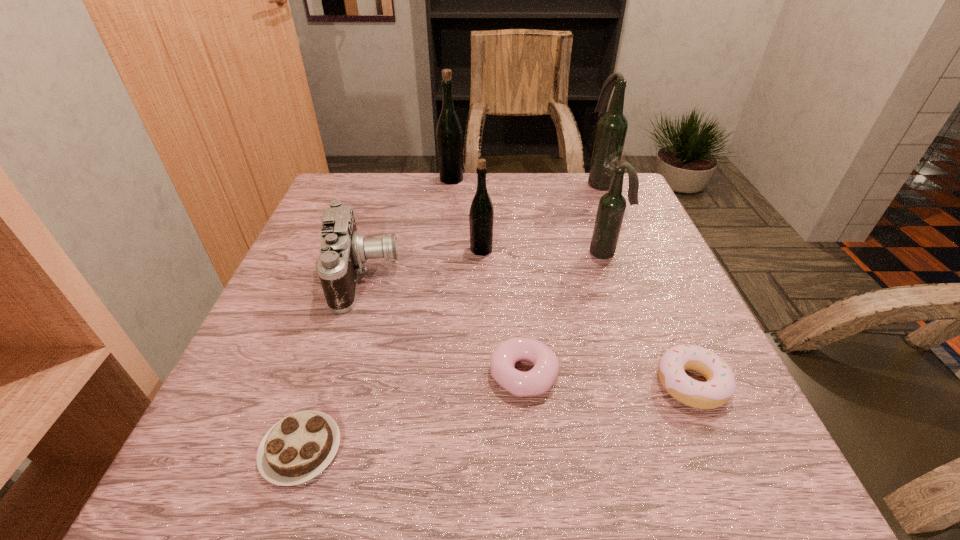
Image resolution: width=960 pixels, height=540 pixels. Find the location of `free space located 0.220m on the front of the leftmost beer bottle`. free space located 0.220m on the front of the leftmost beer bottle is located at coordinates (446, 231).

The height and width of the screenshot is (540, 960). I want to click on free space located 0.220m on the front of the farther dark beer bottle, so click(x=623, y=238).

The height and width of the screenshot is (540, 960). What are the coordinates of `free space located 0.150m on the left of the right green beer bottle` in the screenshot? It's located at (405, 250).

Locate an element on the screen. This screenshot has height=540, width=960. free location located 0.170m on the back of the nearer dark beer bottle is located at coordinates (590, 206).

You are a GUI agent. You are given a task and a screenshot of the screen. Output one action in this format:
    pyautogui.click(x=<x>, y=<y>)
    Task: Click on the vacant space located at the lens of the fifth tallest object
    The width and height of the screenshot is (960, 540).
    Given the screenshot: What is the action you would take?
    pyautogui.click(x=450, y=275)

Locate an element on the screen. free space located 0.110m on the front of the left doughnut is located at coordinates (533, 470).

Locate an element on the screen. free space located on the back of the right doughnut is located at coordinates (640, 264).

I want to click on free spot located 0.210m on the back of the chocolate cake, so click(344, 318).

Find the location of `object that is at the near edge`. object that is at the near edge is located at coordinates (296, 449).

Find the location of a particular element. camera situated at the left edge is located at coordinates (343, 251).